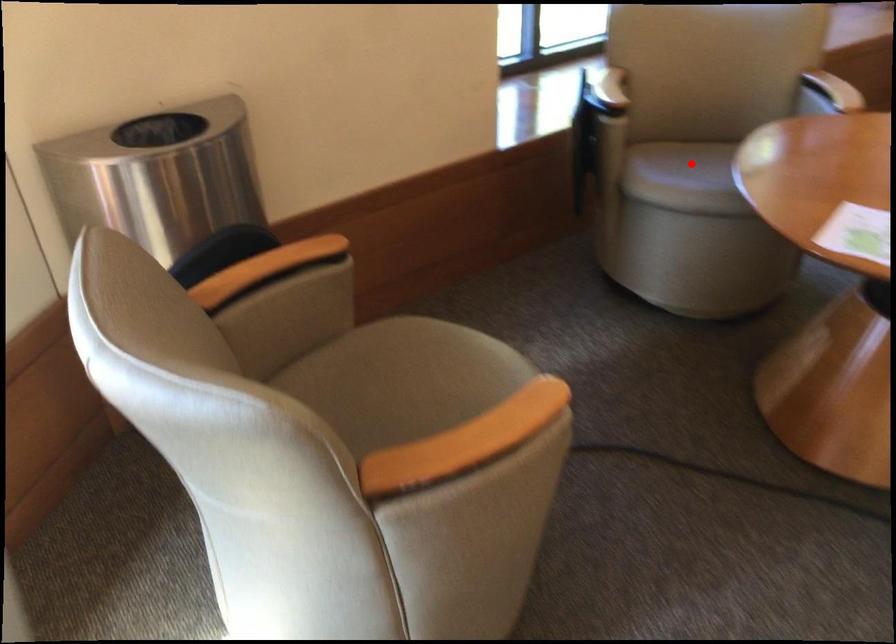
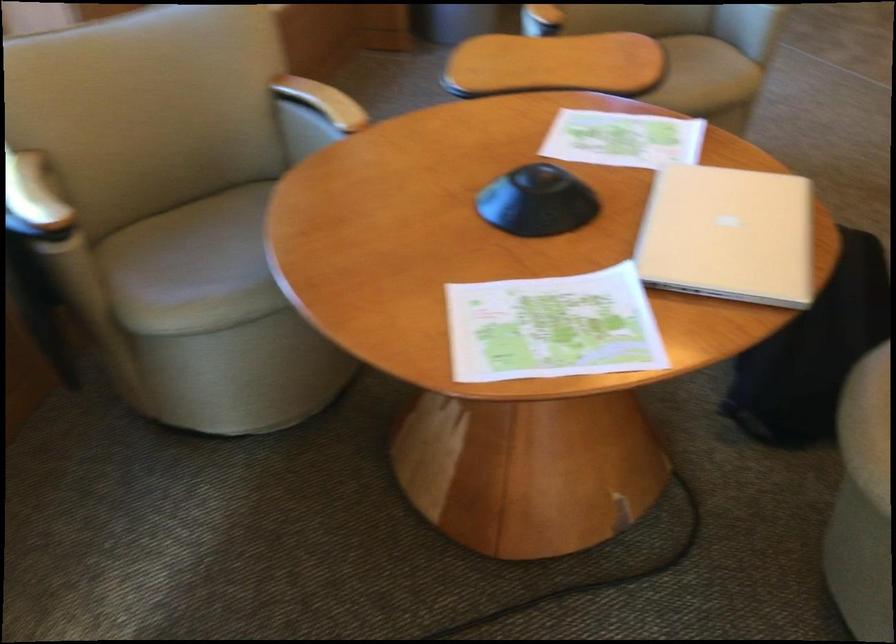
Find the pixel in the second image that matches the highlighted location in the first image.

(193, 267)